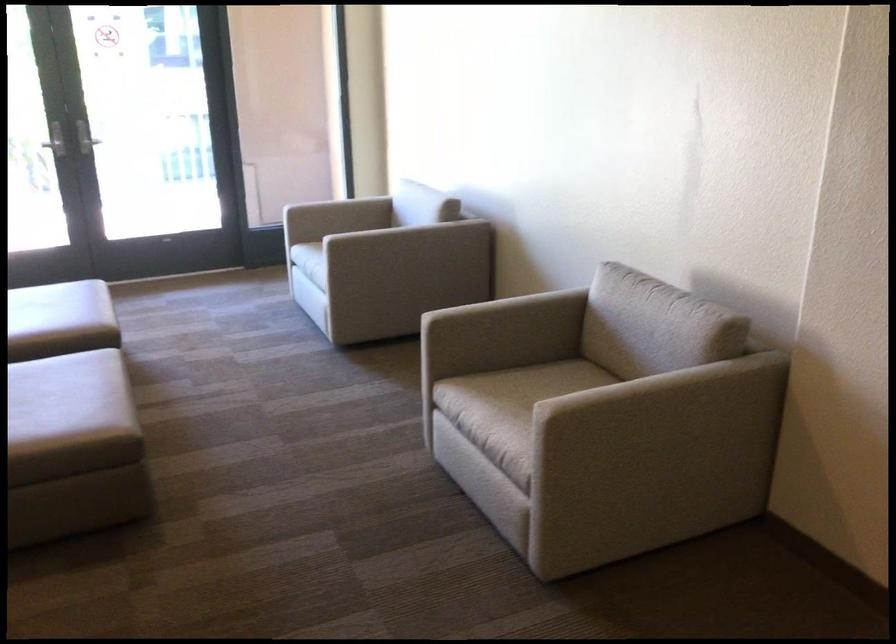
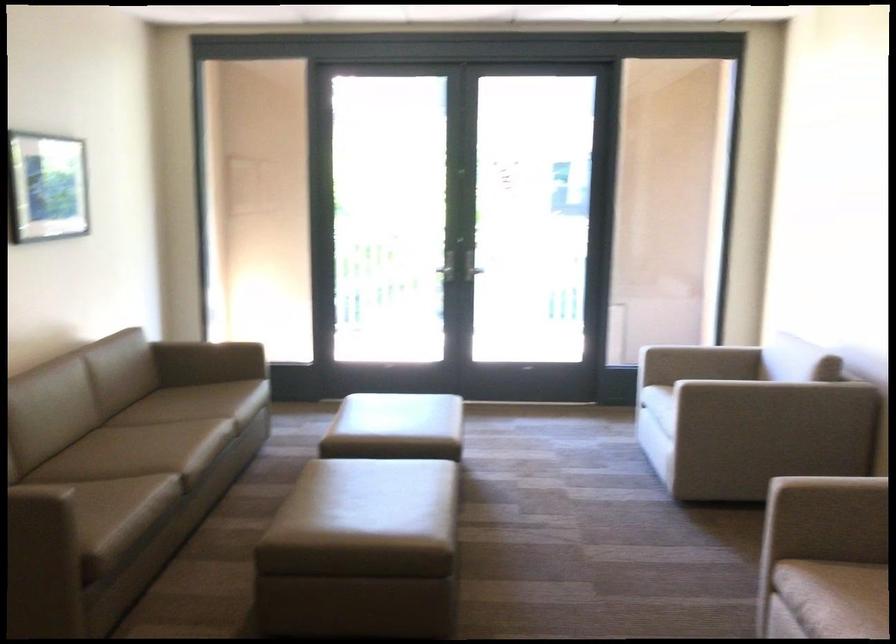
Locate, in the second image, the point that corresponds to [406,230] in the first image.

(774, 392)